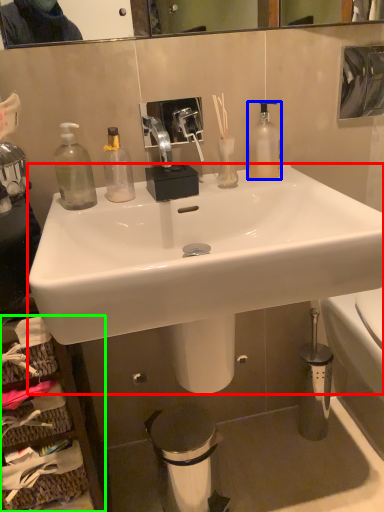
Question: Which object is the farthest from sink (highlighted by a red box)? Choose among these: bottle (highlighted by a blue box) or cabinetry (highlighted by a green box).

Choices:
 (A) bottle
 (B) cabinetry

Answer: (B)